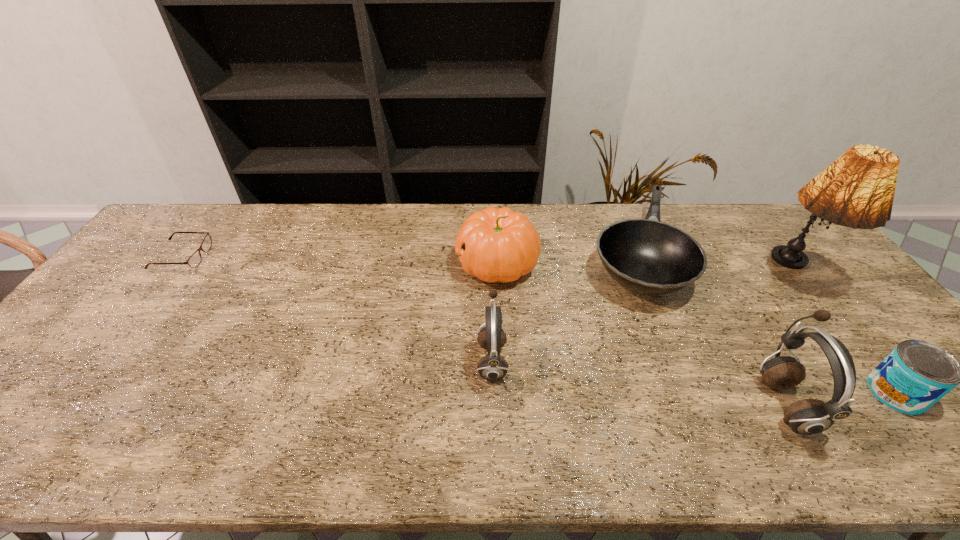
The width and height of the screenshot is (960, 540). Find the location of `free spot between the can and the shortest object`. free spot between the can and the shortest object is located at coordinates (539, 325).

At what (x,y) coordinates should I click in order to perform the action: click on object that is the second closest to the lampshade. Please return your answer as a coordinate pair (x, y). The height and width of the screenshot is (540, 960). Looking at the image, I should click on (809, 416).

At what (x,y) coordinates should I click in order to perform the action: click on the fourth closest object to the fourth object from left to right. Please return your answer as a coordinate pair (x, y). This screenshot has height=540, width=960. Looking at the image, I should click on (492, 367).

Where is `free space that satisfies the following two spatial constraints: 1. on the lenses of the can; 2. on the left side of the spectacles`? The height and width of the screenshot is (540, 960). free space that satisfies the following two spatial constraints: 1. on the lenses of the can; 2. on the left side of the spectacles is located at coordinates [79, 393].

At what (x,y) coordinates should I click in order to perform the action: click on vacant space that satisfies the following two spatial constraints: 1. on the front-facing side of the tallest object; 2. on the ear pads of the shorter earphone. Please return your answer as a coordinate pair (x, y). The image size is (960, 540). Looking at the image, I should click on (857, 360).

The image size is (960, 540). I want to click on free space that satisfies the following two spatial constraints: 1. on the front side of the frying pan; 2. on the carved face of the pumpkin, so click(x=636, y=264).

What are the coordinates of `vacant space that satisfies the following two spatial constraints: 1. on the carved face of the pumpkin; 2. on the right side of the can` in the screenshot? It's located at (503, 393).

At what (x,y) coordinates should I click in order to perform the action: click on free location that satisfies the following two spatial constraints: 1. on the ear pads of the shorter earphone; 2. on the left side of the can. Please return your answer as a coordinate pair (x, y). Looking at the image, I should click on (492, 393).

Find the location of `vacant space that satisfies the following two spatial constraints: 1. on the front-facing side of the lampshade; 2. on the left side of the can`. vacant space that satisfies the following two spatial constraints: 1. on the front-facing side of the lampshade; 2. on the left side of the can is located at coordinates (882, 393).